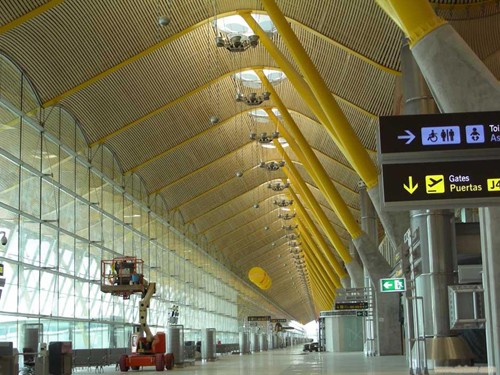
The image size is (500, 375). I want to click on ceiling window, so click(231, 21).